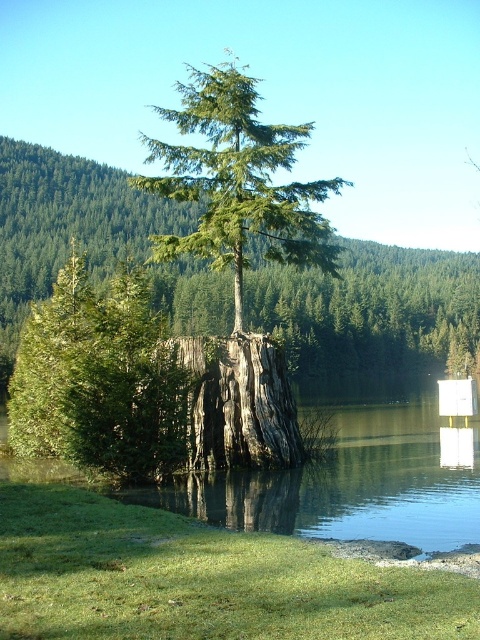
Question: Estimate the real-world distances between objects in this image. Which object is farther from the green rough bark tree at center?

Choices:
 (A) clear water at center
 (B) dark gray rough tree trunk at center

Answer: (A)

Question: Can you confirm if green rough bark tree at center is wider than clear water at center?

Choices:
 (A) no
 (B) yes

Answer: (A)

Question: Considering the real-world distances, which object is closest to the clear water at center?

Choices:
 (A) dark gray rough tree trunk at center
 (B) green rough bark tree at center

Answer: (A)

Question: Does green rough bark tree at center come behind dark gray rough tree trunk at center?

Choices:
 (A) yes
 (B) no

Answer: (A)

Question: Which point appears farthest from the camera in this image?

Choices:
 (A) (282, 390)
 (B) (428, 524)

Answer: (A)

Question: Does green rough bark tree at center have a lesser width compared to dark gray rough tree trunk at center?

Choices:
 (A) yes
 (B) no

Answer: (B)